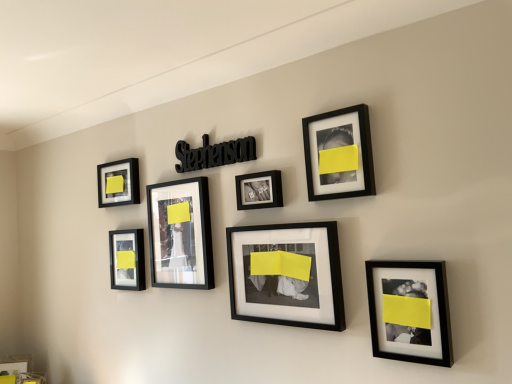
Question: From the image's perspective, does matte black frame at center, which ranks as the 3th picture frame in left-to-right order, appear higher than matte black frame at center, marked as the fifth picture frame in a left-to-right arrangement?

Choices:
 (A) yes
 (B) no

Answer: (A)

Question: Is matte black frame at center, the fifth picture frame in the right-to-left sequence, at the right side of matte black frame at center, which ranks as the third picture frame in right-to-left order?

Choices:
 (A) yes
 (B) no

Answer: (B)

Question: Is matte black frame at center, the fifth picture frame in the right-to-left sequence, looking in the opposite direction of matte black frame at center, marked as the fifth picture frame in a left-to-right arrangement?

Choices:
 (A) yes
 (B) no

Answer: (B)

Question: Can you confirm if matte black frame at center, which ranks as the 3th picture frame in left-to-right order, is positioned to the left of matte black frame at center, marked as the fifth picture frame in a left-to-right arrangement?

Choices:
 (A) no
 (B) yes

Answer: (B)

Question: Is matte black frame at center, the fifth picture frame in the right-to-left sequence, next to matte black frame at center, which ranks as the third picture frame in right-to-left order, and touching it?

Choices:
 (A) no
 (B) yes

Answer: (A)

Question: Is matte black frame at center, which ranks as the 3th picture frame in left-to-right order, not inside matte black frame at center, which ranks as the third picture frame in right-to-left order?

Choices:
 (A) no
 (B) yes

Answer: (B)

Question: Is black matte picture frame at lower right, which ranks as the 7th picture frame in left-to-right order, positioned far away from matte black frame at center, which ranks as the third picture frame in right-to-left order?

Choices:
 (A) no
 (B) yes

Answer: (A)

Question: Is black matte picture frame at lower right, acting as the 1th picture frame starting from the right, at the left side of matte black frame at center, which ranks as the third picture frame in right-to-left order?

Choices:
 (A) no
 (B) yes

Answer: (A)

Question: Is black matte picture frame at lower right, acting as the 1th picture frame starting from the right, looking in the opposite direction of matte black frame at center, which ranks as the third picture frame in right-to-left order?

Choices:
 (A) yes
 (B) no

Answer: (B)

Question: Can you confirm if black matte picture frame at lower right, acting as the 1th picture frame starting from the right, is thinner than matte black frame at center, marked as the fifth picture frame in a left-to-right arrangement?

Choices:
 (A) no
 (B) yes

Answer: (A)

Question: From the image's perspective, is black matte picture frame at lower right, acting as the 1th picture frame starting from the right, located above matte black frame at center, marked as the fifth picture frame in a left-to-right arrangement?

Choices:
 (A) no
 (B) yes

Answer: (A)

Question: Does black matte picture frame at lower right, acting as the 1th picture frame starting from the right, have a lesser height compared to matte black frame at center, which ranks as the third picture frame in right-to-left order?

Choices:
 (A) yes
 (B) no

Answer: (A)

Question: From the image's perspective, is black matte picture frame at lower right, acting as the 1th picture frame starting from the right, below matte black picture frame at lower left, the 6th picture frame when ordered from right to left?

Choices:
 (A) yes
 (B) no

Answer: (A)